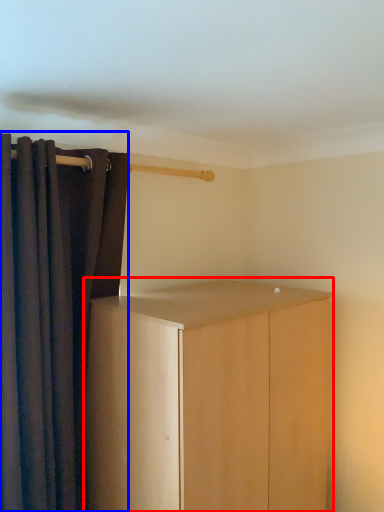
Question: Which object appears closest to the camera in this image, cupboard (highlighted by a red box) or curtain (highlighted by a blue box)?

Choices:
 (A) cupboard
 (B) curtain

Answer: (A)